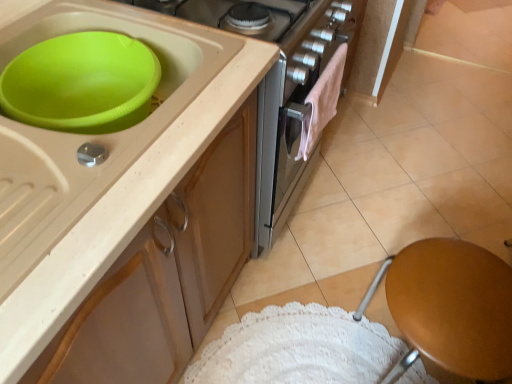
Where is `empty space that is ontop of brown wooden stool at lower right (from a real-world perspective)`? The width and height of the screenshot is (512, 384). empty space that is ontop of brown wooden stool at lower right (from a real-world perspective) is located at coordinates (459, 297).